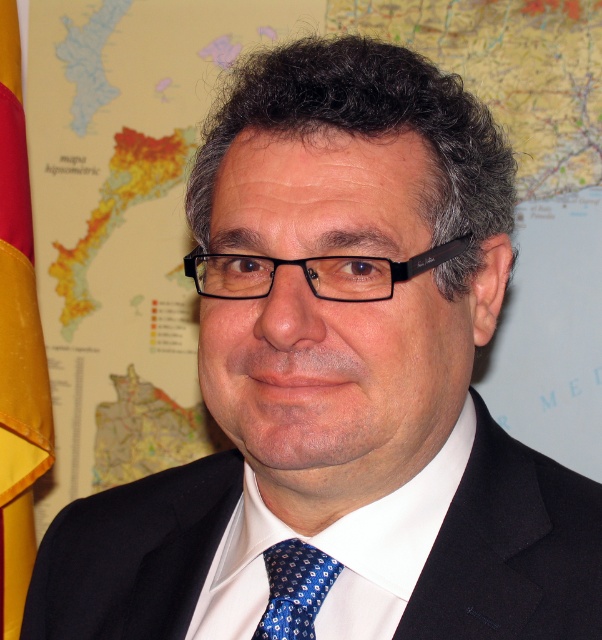
Question: Observing the image, what is the correct spatial positioning of black textured suit at center in reference to yellow satin flag at left?

Choices:
 (A) below
 (B) above

Answer: (A)

Question: Among these objects, which one is nearest to the camera?

Choices:
 (A) black textured suit at center
 (B) white smooth dress shirt at center
 (C) blue silk tie at center

Answer: (A)

Question: Does white smooth dress shirt at center appear on the left side of black plastic glasses at center?

Choices:
 (A) yes
 (B) no

Answer: (B)

Question: Which object is farther from the camera taking this photo?

Choices:
 (A) white smooth dress shirt at center
 (B) black plastic glasses at center

Answer: (A)

Question: Among these objects, which one is nearest to the camera?

Choices:
 (A) black plastic glasses at center
 (B) white smooth dress shirt at center
 (C) blue silk tie at center
 (D) black textured suit at center

Answer: (A)

Question: Can you confirm if white smooth dress shirt at center is positioned to the right of blue silk tie at center?

Choices:
 (A) yes
 (B) no

Answer: (A)